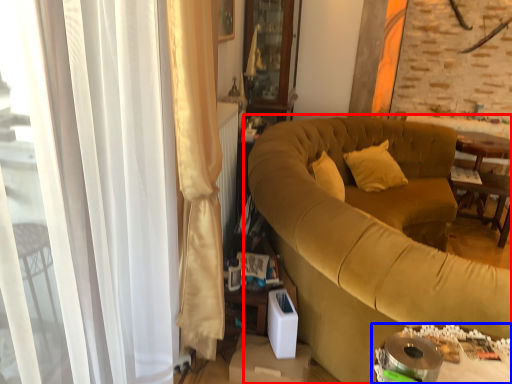
Question: Which object appears farthest to the camera in this image, studio couch (highlighted by a red box) or table (highlighted by a blue box)?

Choices:
 (A) studio couch
 (B) table

Answer: (A)